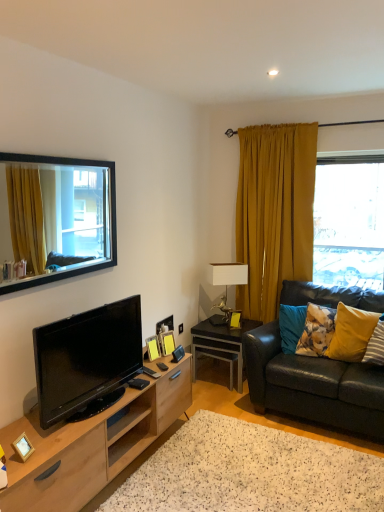
Where is `empty space that is ontop of white speckled rug at lower center (from a real-world perspective)`? empty space that is ontop of white speckled rug at lower center (from a real-world perspective) is located at coordinates (238, 463).